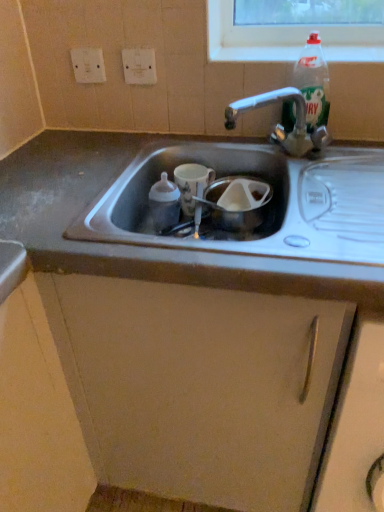
Question: From a real-world perspective, is matte plastic bottle at sink center, the first bottle positioned from the bottom, positioned above or below clear glass bottle at upper center?

Choices:
 (A) above
 (B) below

Answer: (B)

Question: Is matte plastic bottle at sink center, the first bottle positioned from the bottom, taller or shorter than clear glass bottle at upper center?

Choices:
 (A) short
 (B) tall

Answer: (B)

Question: Based on their relative distances, which object is nearer to the clear plastic bottle at upper right, marked as the 2th bottle in a left-to-right arrangement?

Choices:
 (A) metallic gray cabinet at center
 (B) white plastic electric outlet at upper center, the second electric outlet viewed from the left
 (C) white glossy cup at center
 (D) white plastic electric outlet at upper left, placed as the 1th electric outlet when sorted from left to right
 (E) matte plastic bottle at sink center, the second bottle when ordered from right to left

Answer: (C)

Question: Which object is positioned farthest from the white plastic electric outlet at upper left, placed as the 1th electric outlet when sorted from left to right?

Choices:
 (A) clear plastic bottle at upper right, which ranks as the second bottle in bottom-to-top order
 (B) clear glass bottle at upper center
 (C) metallic gray cabinet at center
 (D) white glossy cup at center
 (E) white plastic electric outlet at upper center, the second electric outlet viewed from the left

Answer: (C)